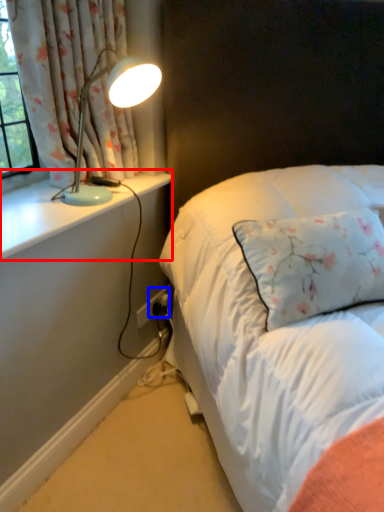
Question: Which of the following is the closest to the observer, window sill (highlighted by a red box) or electric outlet (highlighted by a blue box)?

Choices:
 (A) window sill
 (B) electric outlet

Answer: (A)